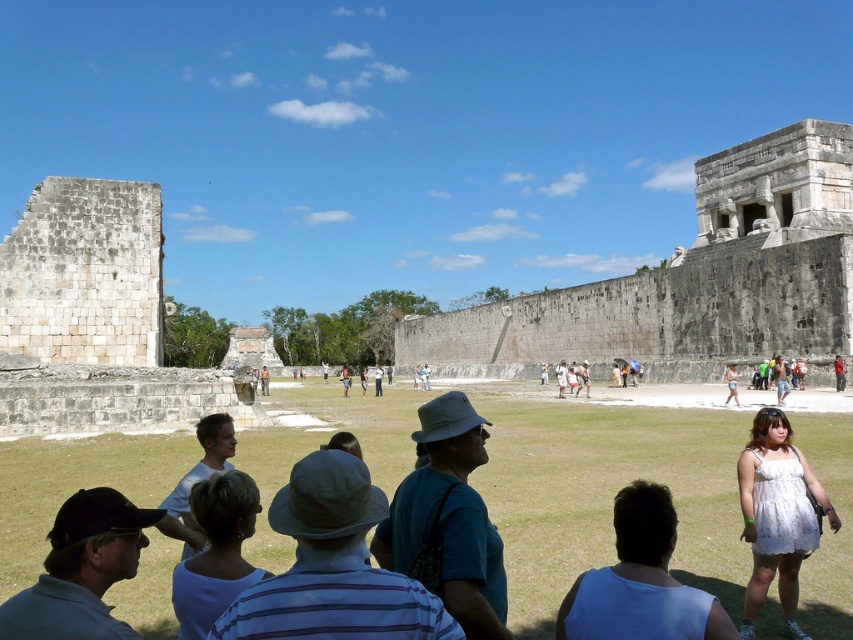
Can you confirm if white lace dress at center is bigger than white cotton dress at lower right?

Correct, white lace dress at center is larger in size than white cotton dress at lower right.

Which is below, white lace dress at center or white cotton dress at lower right?

white lace dress at center is lower down.

Locate an element on the screen. white lace dress at center is located at coordinates (776, 515).

Is white matte shirt at center below white cotton dress at center-right?

Indeed, white matte shirt at center is positioned under white cotton dress at center-right.

Between white matte shirt at center and white cotton dress at center-right, which one has less height?

Standing shorter between the two is white cotton dress at center-right.

Who is more distant from viewer, [166,532] or [730,397]?

The point [730,397] is behind.

Where is `white matte shirt at center`? This screenshot has height=640, width=853. white matte shirt at center is located at coordinates (196, 481).

Between gray stone wall at center and white fabric shirt at lower right, which one appears on the right side from the viewer's perspective?

gray stone wall at center

Is gray stone wall at center to the right of white fabric shirt at lower right from the viewer's perspective?

Correct, you'll find gray stone wall at center to the right of white fabric shirt at lower right.

Is point (631, 298) farther from viewer compared to point (650, 509)?

Yes, point (631, 298) is behind point (650, 509).

Locate an element on the screen. gray stone wall at center is located at coordinates (695, 273).